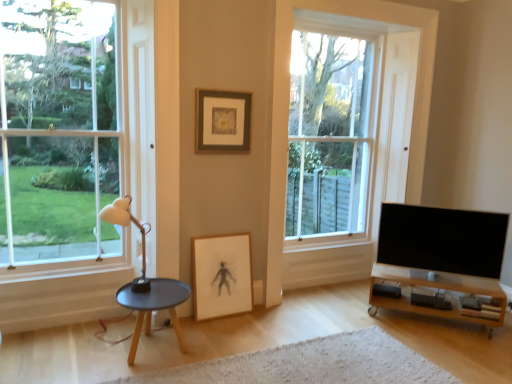
Question: Is white matte lamp at left outside wooden tv stand at lower right?

Choices:
 (A) yes
 (B) no

Answer: (A)

Question: Can you confirm if white matte lamp at left is wider than wooden tv stand at lower right?

Choices:
 (A) yes
 (B) no

Answer: (A)

Question: Considering the relative sizes of white matte lamp at left and wooden tv stand at lower right in the image provided, is white matte lamp at left bigger than wooden tv stand at lower right?

Choices:
 (A) yes
 (B) no

Answer: (A)

Question: Is wooden tv stand at lower right at the back of white matte lamp at left?

Choices:
 (A) no
 (B) yes

Answer: (A)

Question: From a real-world perspective, is white matte lamp at left physically below wooden tv stand at lower right?

Choices:
 (A) no
 (B) yes

Answer: (A)

Question: Is white matte lamp at left positioned in front of wooden tv stand at lower right?

Choices:
 (A) no
 (B) yes

Answer: (B)

Question: Is wooden tv stand at lower right further to camera compared to clear glass window at left, the 1th window positioned from the front?

Choices:
 (A) yes
 (B) no

Answer: (A)

Question: Is wooden tv stand at lower right at the left side of clear glass window at left, which is the 2th window from back to front?

Choices:
 (A) no
 (B) yes

Answer: (A)

Question: From the image's perspective, does wooden tv stand at lower right appear lower than clear glass window at left, the 1th window positioned from the front?

Choices:
 (A) no
 (B) yes

Answer: (B)

Question: From the image's perspective, does wooden tv stand at lower right appear higher than clear glass window at left, which is the 2th window from back to front?

Choices:
 (A) no
 (B) yes

Answer: (A)

Question: Does wooden tv stand at lower right have a lesser height compared to clear glass window at left, which is the 2th window from back to front?

Choices:
 (A) no
 (B) yes

Answer: (B)

Question: Does wooden tv stand at lower right have a lesser width compared to clear glass window at left, the 1th window positioned from the front?

Choices:
 (A) no
 (B) yes

Answer: (A)

Question: Is clear glass window at center, which is counted as the 1th window, starting from the back, outside white textured rug at lower center?

Choices:
 (A) yes
 (B) no

Answer: (A)